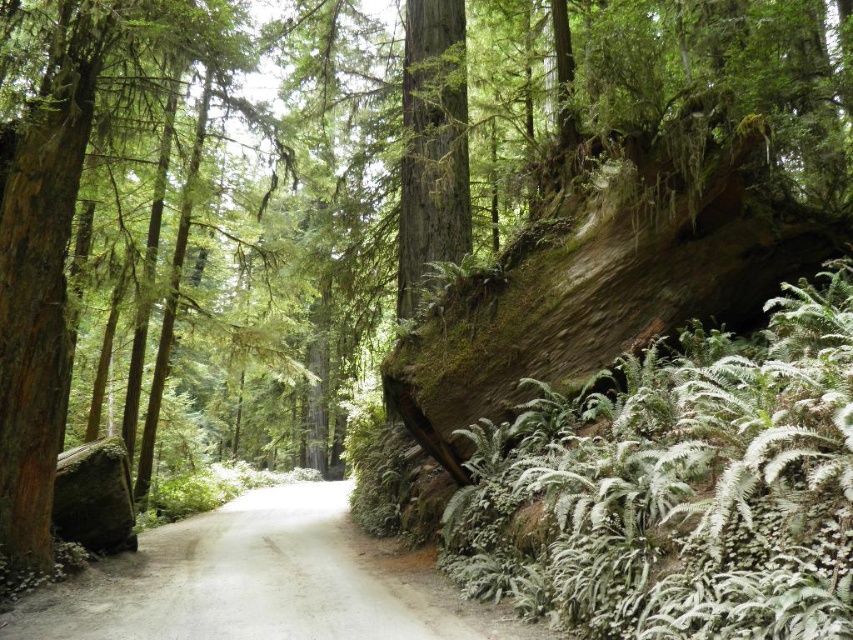
Question: Is gray concrete road at center behind smooth brown tree trunk at center?

Choices:
 (A) no
 (B) yes

Answer: (A)

Question: Is gray concrete road at center wider than smooth brown tree trunk at center?

Choices:
 (A) yes
 (B) no

Answer: (A)

Question: Which of the following is the closest to the observer?

Choices:
 (A) gray concrete road at center
 (B) smooth brown tree trunk at center

Answer: (A)

Question: Can you confirm if gray concrete road at center is thinner than smooth brown tree trunk at center?

Choices:
 (A) yes
 (B) no

Answer: (B)

Question: Among these objects, which one is nearest to the camera?

Choices:
 (A) smooth brown tree trunk at center
 (B) gray concrete road at center

Answer: (B)